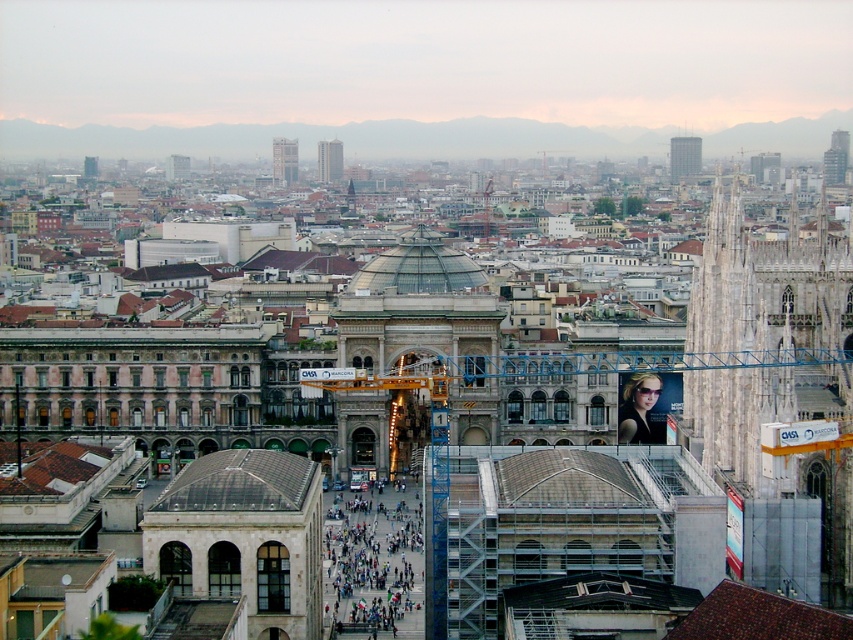
What do you see at coordinates (640, 410) in the screenshot? I see `shiny black sunglasses at center` at bounding box center [640, 410].

Does point (637, 433) lie behind point (685, 138)?

No, (637, 433) is closer to viewer.

Is point (636, 376) closer to camera compared to point (672, 147)?

Yes.

Where is `shiny black sunglasses at center`? The width and height of the screenshot is (853, 640). shiny black sunglasses at center is located at coordinates (640, 410).

Image resolution: width=853 pixels, height=640 pixels. What do you see at coordinates (283, 161) in the screenshot?
I see `smooth glass skyscraper at center` at bounding box center [283, 161].

Locate an element on the screen. smooth glass skyscraper at center is located at coordinates (283, 161).

Between gray concrete skyscraper at upper right and smooth glass skyscraper at center, which one appears on the right side from the viewer's perspective?

From the viewer's perspective, gray concrete skyscraper at upper right appears more on the right side.

Does gray concrete skyscraper at upper right have a lesser width compared to smooth glass skyscraper at center?

No.

Is point (700, 141) less distant than point (286, 164)?

No, it is behind (286, 164).

Locate an element on the screen. This screenshot has height=640, width=853. gray concrete skyscraper at upper right is located at coordinates (683, 156).